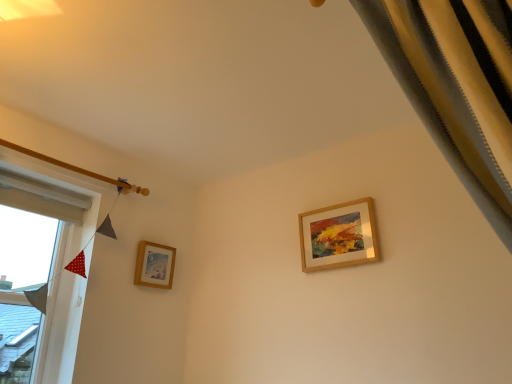
Question: Considering the relative sizes of wooden picture frame at upper right, which is counted as the 1th picture frame, starting from the front, and white fabric at left in the image provided, is wooden picture frame at upper right, which is counted as the 1th picture frame, starting from the front, bigger than white fabric at left?

Choices:
 (A) yes
 (B) no

Answer: (B)

Question: From the image's perspective, does wooden picture frame at upper right, which is counted as the 1th picture frame, starting from the front, appear lower than white fabric at left?

Choices:
 (A) yes
 (B) no

Answer: (B)

Question: Does wooden picture frame at upper right, which is counted as the 2th picture frame, starting from the back, appear on the left side of white fabric at left?

Choices:
 (A) yes
 (B) no

Answer: (B)

Question: Considering the relative sizes of wooden picture frame at upper right, acting as the 2th picture frame starting from the left, and white fabric at left in the image provided, is wooden picture frame at upper right, acting as the 2th picture frame starting from the left, taller than white fabric at left?

Choices:
 (A) no
 (B) yes

Answer: (A)

Question: Is white fabric at left inside wooden picture frame at upper right, which is counted as the 2th picture frame, starting from the back?

Choices:
 (A) no
 (B) yes

Answer: (A)

Question: Can we say wooden picture frame at upper right, the 1th picture frame in the right-to-left sequence, lies outside white fabric at left?

Choices:
 (A) no
 (B) yes

Answer: (B)

Question: Considering the relative sizes of wooden picture frame at lower left, the first picture frame in the left-to-right sequence, and white fabric at left in the image provided, is wooden picture frame at lower left, the first picture frame in the left-to-right sequence, smaller than white fabric at left?

Choices:
 (A) yes
 (B) no

Answer: (A)

Question: From the image's perspective, is wooden picture frame at lower left, the first picture frame in the left-to-right sequence, under white fabric at left?

Choices:
 (A) yes
 (B) no

Answer: (B)

Question: Considering the relative sizes of wooden picture frame at lower left, acting as the 1th picture frame starting from the back, and white fabric at left in the image provided, is wooden picture frame at lower left, acting as the 1th picture frame starting from the back, wider than white fabric at left?

Choices:
 (A) yes
 (B) no

Answer: (B)

Question: Does wooden picture frame at lower left, acting as the 1th picture frame starting from the back, come behind white fabric at left?

Choices:
 (A) yes
 (B) no

Answer: (A)

Question: Can you confirm if wooden picture frame at lower left, the first picture frame in the left-to-right sequence, is positioned to the left of white fabric at left?

Choices:
 (A) yes
 (B) no

Answer: (B)

Question: From a real-world perspective, is wooden picture frame at lower left, placed as the second picture frame when sorted from right to left, physically below white fabric at left?

Choices:
 (A) no
 (B) yes

Answer: (A)

Question: Can you confirm if white fabric at left is taller than wooden picture frame at upper right, which is counted as the 1th picture frame, starting from the front?

Choices:
 (A) yes
 (B) no

Answer: (A)